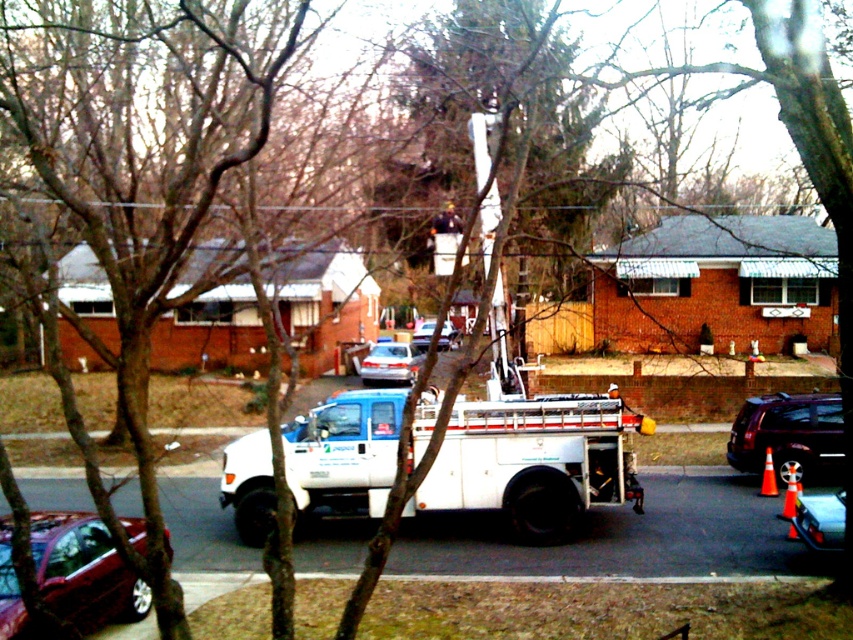
Can you confirm if white matte utility truck at center is thinner than metallic silver car at lower right?

No, white matte utility truck at center is not thinner than metallic silver car at lower right.

Find the location of a particular element. Image resolution: width=853 pixels, height=640 pixels. white matte utility truck at center is located at coordinates (529, 452).

Is point (514, 369) behind point (817, 493)?

No, (514, 369) is in front of (817, 493).

This screenshot has height=640, width=853. Identify the location of white matte utility truck at center. (529, 452).

Can you confirm if white matte utility truck at center is smaller than satin silver sedan at center?

Actually, white matte utility truck at center might be larger than satin silver sedan at center.

Is point (236, 461) behind point (393, 365)?

No, (236, 461) is in front of (393, 365).

The image size is (853, 640). In order to click on white matte utility truck at center in this screenshot , I will do `click(529, 452)`.

Is white metallic utility truck at center further to camera compared to satin silver sedan at center?

No, it is in front of satin silver sedan at center.

Does white metallic utility truck at center have a lesser height compared to satin silver sedan at center?

Correct, white metallic utility truck at center is not as tall as satin silver sedan at center.

Identify the location of white metallic utility truck at center. The image size is (853, 640). pyautogui.click(x=532, y=461).